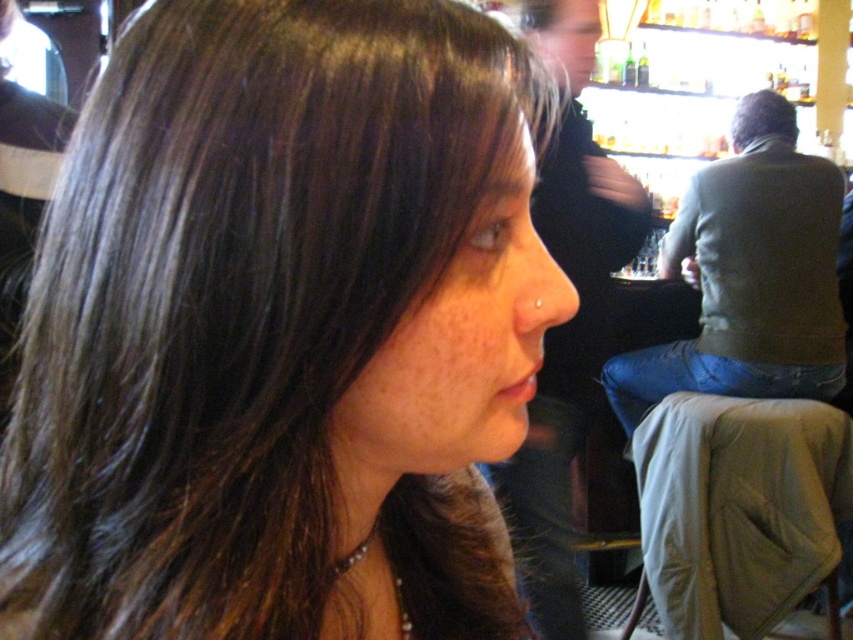
You are taking a photo of the person in the image. You want to focus on the point closer to the camera. Which point should you choose between point (361, 49) and point (772, 131)?

Point (361, 49) is closer to the camera than point (772, 131), so you should choose point (361, 49) to focus on.

You are standing in a bar and want to place a 12 inch wide drink coaster at the point marked as point (302,420). Can the coaster fit without overlapping the edge?

The point (302,420) and viewer are 13.20 inches apart. Since the coaster is 12 inches wide, it can fit within the 13.20 inches distance from the viewer to the point, so yes, the coaster can be placed there without overlapping the edge.

You are an artist trying to sketch the person in the image. You need to position the dark brown hair at center accurately. What are the coordinates for its location?

The dark brown hair at center is located at coordinates 0.519 on the x axis and 0.331 on the y axis.